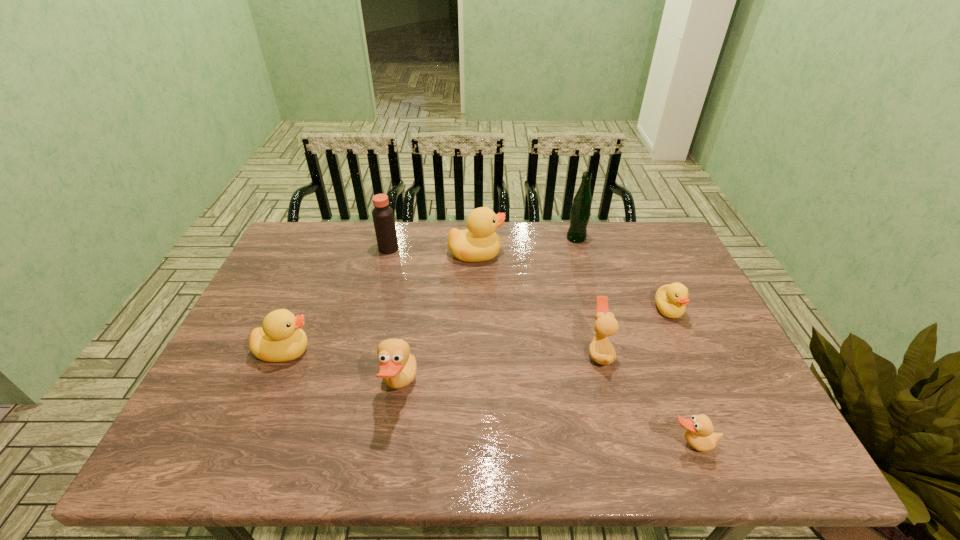
The width and height of the screenshot is (960, 540). I want to click on object at the near right corner, so click(x=699, y=433).

This screenshot has width=960, height=540. What are the coordinates of `vacant region at the far edge of the desktop` in the screenshot? It's located at (515, 243).

In the image, there is a desktop. Where is `vacant space at the near edge`? The image size is (960, 540). vacant space at the near edge is located at coordinates (306, 463).

This screenshot has width=960, height=540. Identify the location of blank space at the left edge of the desktop. (249, 315).

Image resolution: width=960 pixels, height=540 pixels. In order to click on vacant space at the right edge of the desktop in this screenshot , I will do `click(670, 330)`.

In the image, there is a desktop. Identify the location of vacant space at the far left corner. (322, 225).

Where is `free space at the far right corner of the desktop`? This screenshot has width=960, height=540. free space at the far right corner of the desktop is located at coordinates (650, 261).

Locate an element on the screen. The height and width of the screenshot is (540, 960). vacant space that's between the farthest duck and the nearest tan duck is located at coordinates (584, 349).

Where is `free space between the fourth farthest object and the nearest tan duck`? free space between the fourth farthest object and the nearest tan duck is located at coordinates (680, 377).

Where is `vacant region between the seventh object from right to left and the third duck from right to left`? vacant region between the seventh object from right to left and the third duck from right to left is located at coordinates (493, 300).